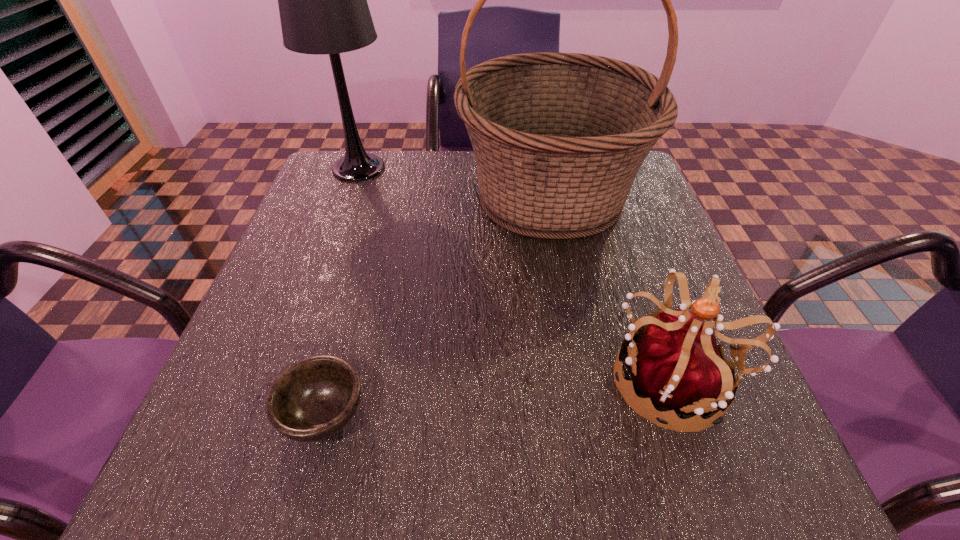
Find the location of a particular element. The height and width of the screenshot is (540, 960). object located in the far right corner section of the desktop is located at coordinates (558, 138).

Locate an element on the screen. Image resolution: width=960 pixels, height=540 pixels. object present at the near right corner is located at coordinates (677, 364).

You are a GUI agent. You are given a task and a screenshot of the screen. Output one action in this format:
    pyautogui.click(x=<x>, y=<y>)
    Task: Click on the free point at the far edge
    The image size is (960, 540).
    Given the screenshot: What is the action you would take?
    pyautogui.click(x=394, y=169)

Identify the location of vacant space at the near edge. (578, 444).

Where is `free region at the left edge of the desktop`? free region at the left edge of the desktop is located at coordinates (274, 314).

Find the location of a particular element. vacant space at the right edge is located at coordinates (621, 217).

Locate an element on the screen. This screenshot has height=540, width=960. free region at the far left corner is located at coordinates (324, 177).

Find the location of a particular element. This screenshot has width=960, height=540. vacant space at the near right corner of the desktop is located at coordinates (697, 475).

The image size is (960, 540). I want to click on vacant point located between the shortest object and the tiara, so click(499, 396).

The image size is (960, 540). I want to click on empty space between the tiara and the table lamp, so click(x=516, y=274).